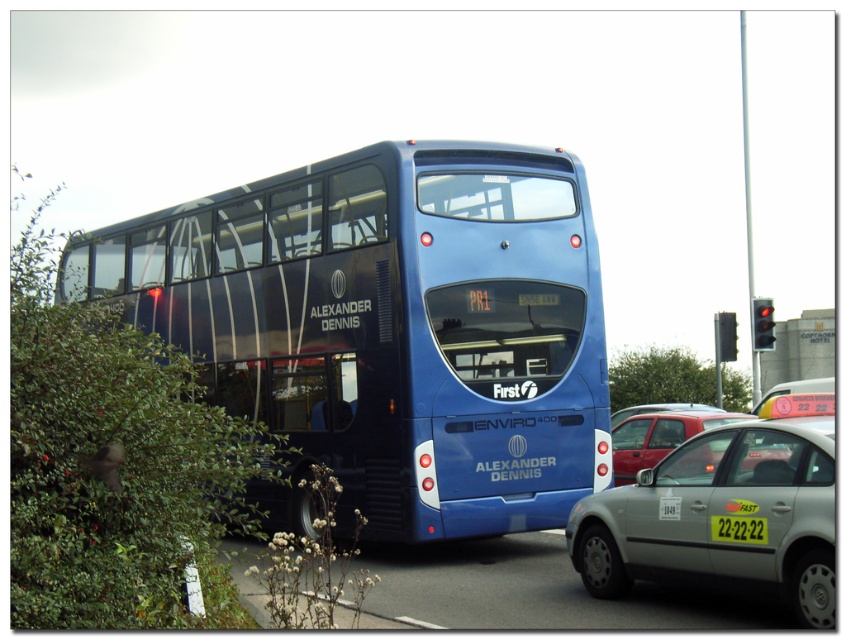
You are a pedestrian standing at the crosswalk and see the green plastic license plate at center and the matte red car at center. Which object is closer to you?

The green plastic license plate at center is closer to you because it is in front of the matte red car at center.